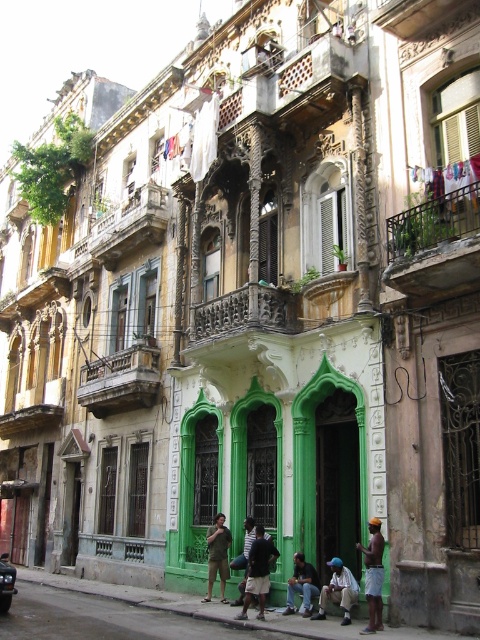
You are a delivery person standing at the entrance of the building. You need to deliver a package to the rusty metal balcony at upper right and then to the brown fabric shorts at lower right. Given that your delivery cart can move 2 meters per second, how long will it take you to travel from the balcony to the shorts?

The distance between the rusty metal balcony at upper right and the brown fabric shorts at lower right is 15.60 meters. At a speed of 2 meters per second, the time required would be 15.60 divided by 2, which equals 7.8 seconds. Therefore, it will take approximately 7.8 seconds to travel between them.